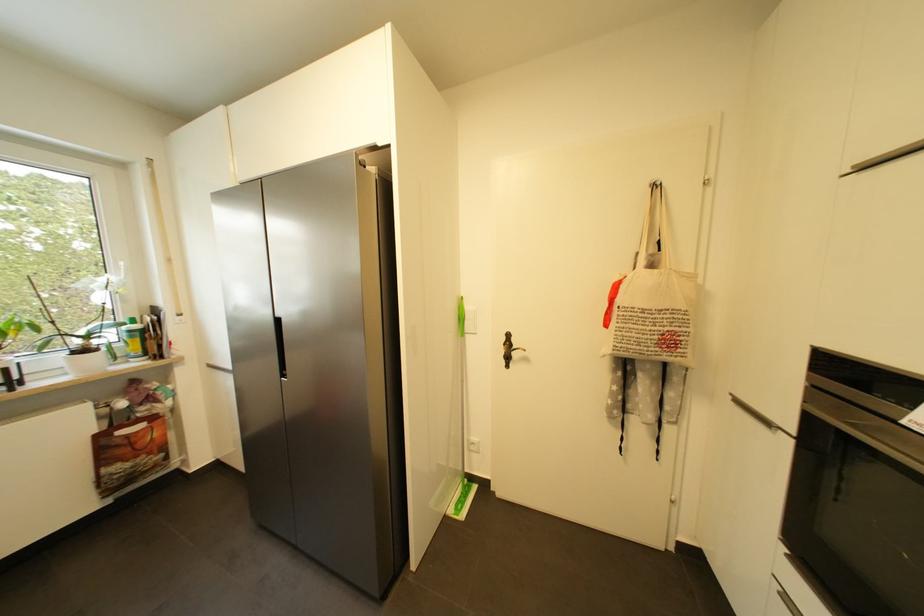
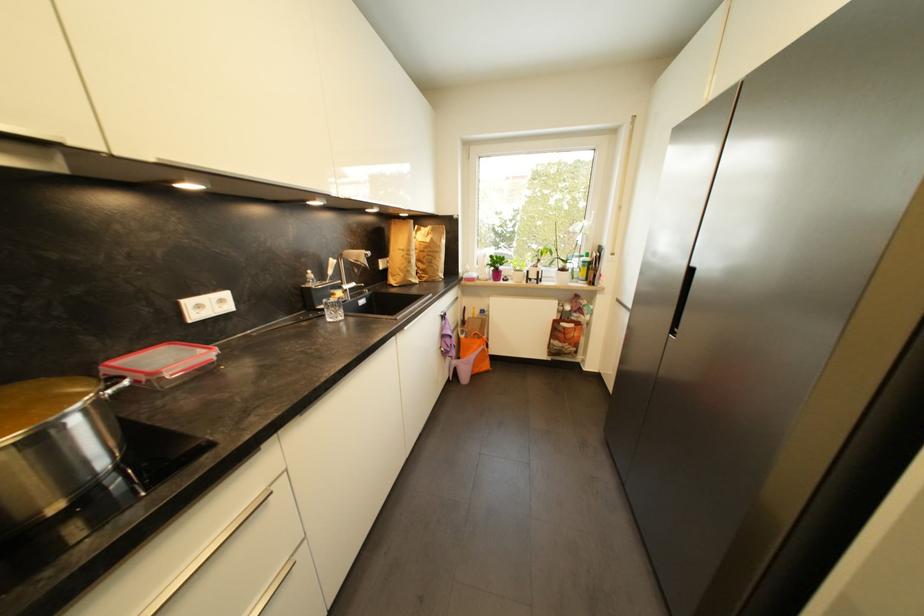
In the second image, find the point that corresponds to the point at 118,280 in the first image.

(590, 225)